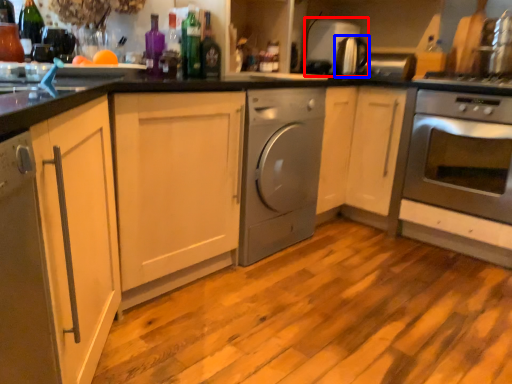
Question: Which object appears farthest to the camera in this image, appliance (highlighted by a red box) or appliance (highlighted by a blue box)?

Choices:
 (A) appliance
 (B) appliance

Answer: (A)